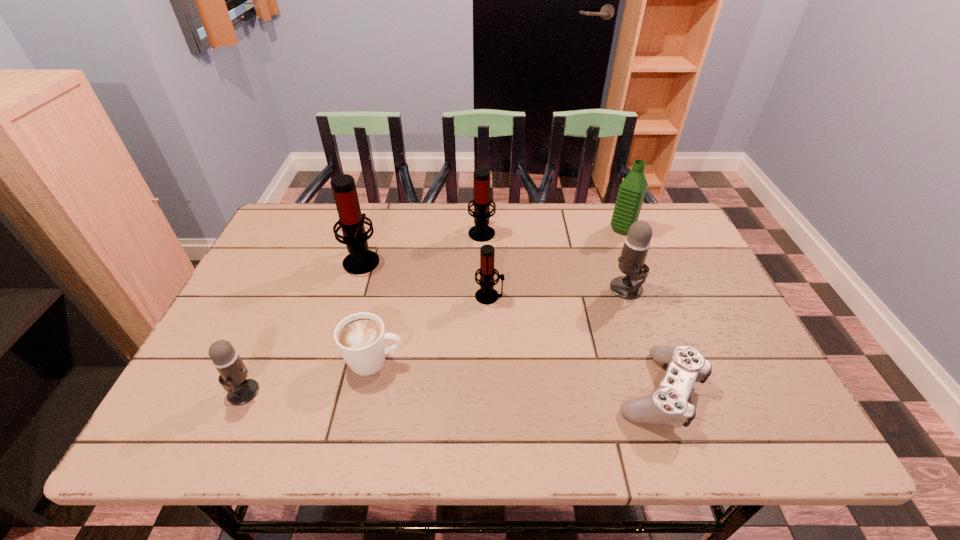
Identify the location of object that is at the near right corner. (668, 405).

This screenshot has width=960, height=540. In the image, there is a desktop. Find the location of `free space at the far edge`. free space at the far edge is located at coordinates (569, 215).

You are a GUI agent. You are given a task and a screenshot of the screen. Output one action in this format:
    pyautogui.click(x=<x>, y=<y>)
    Task: Click on the free region at the near edge of the desktop
    The image size is (960, 540).
    Given the screenshot: What is the action you would take?
    pyautogui.click(x=580, y=426)

You are a GUI agent. You are given a task and a screenshot of the screen. Output one action in this format:
    pyautogui.click(x=<x>, y=<y>)
    Task: Click on the vacant area at the left edge
    
    Given the screenshot: What is the action you would take?
    pyautogui.click(x=275, y=258)

Locate an element on the screen. Image resolution: width=960 pixels, height=540 pixels. blank space at the right edge of the desktop is located at coordinates (686, 260).

The image size is (960, 540). I want to click on vacant space at the far right corner, so click(656, 225).

The width and height of the screenshot is (960, 540). Find the location of `free space between the biggest red microphone and the water bottle`. free space between the biggest red microphone and the water bottle is located at coordinates (492, 245).

I want to click on vacant area that lies between the cappuccino and the second nearest red microphone, so click(x=369, y=310).

Where is `vacant point located between the nearest red microphone and the seventh tallest object`? The height and width of the screenshot is (540, 960). vacant point located between the nearest red microphone and the seventh tallest object is located at coordinates (432, 328).

I want to click on vacant region between the rightmost microphone and the control, so click(642, 340).